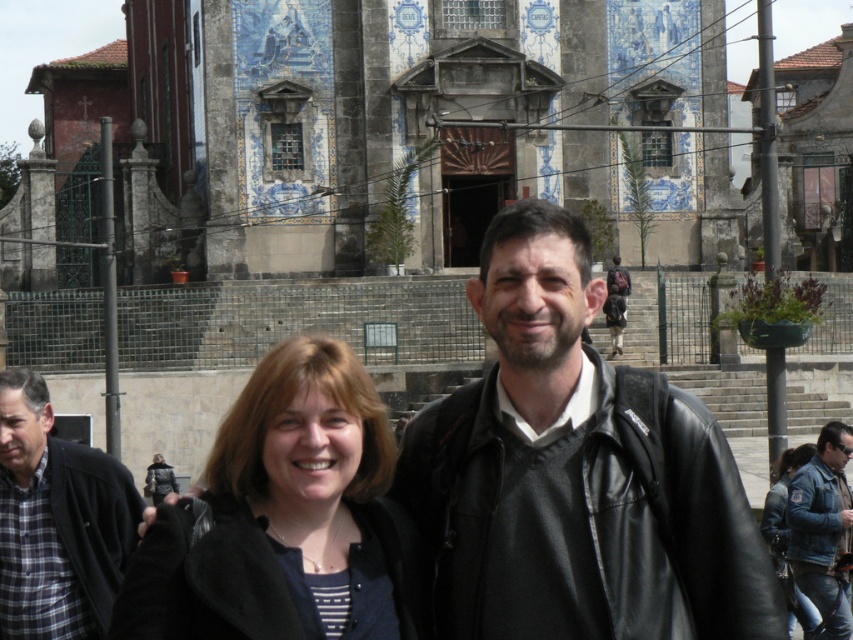
Measure the distance between point (222, 445) and camera.

53.57 meters

Measure the distance between black matte jacket at center and camera.

black matte jacket at center is 47.71 meters from camera.

The height and width of the screenshot is (640, 853). Describe the element at coordinates (285, 516) in the screenshot. I see `black matte jacket at center` at that location.

I want to click on black matte jacket at center, so click(285, 516).

Can you confirm if plaid fabric shirt at left is thinner than blue denim jeans at lower right?

Yes, plaid fabric shirt at left is thinner than blue denim jeans at lower right.

Does plaid fabric shirt at left have a greater width compared to blue denim jeans at lower right?

No.

Where is `plaid fabric shirt at left`? plaid fabric shirt at left is located at coordinates (56, 522).

Locate an element on the screen. This screenshot has height=640, width=853. plaid fabric shirt at left is located at coordinates (56, 522).

Between black matte jacket at center and denim jacket at lower right, which one has less height?

denim jacket at lower right is shorter.

Looking at this image, does black matte jacket at center have a greater height compared to denim jacket at lower right?

Correct, black matte jacket at center is much taller as denim jacket at lower right.

Image resolution: width=853 pixels, height=640 pixels. What do you see at coordinates (285, 516) in the screenshot? I see `black matte jacket at center` at bounding box center [285, 516].

I want to click on black matte jacket at center, so click(285, 516).